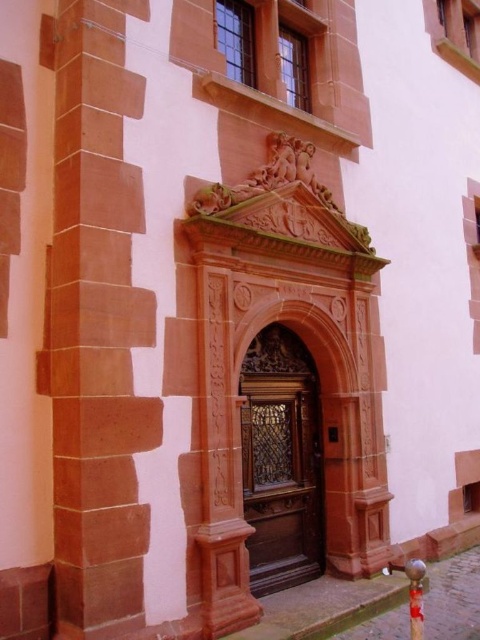
Question: Does brown carved wood door at center appear on the right side of shiny metallic pole at center?

Choices:
 (A) no
 (B) yes

Answer: (A)

Question: Which point is closer to the camera?

Choices:
 (A) (97, 214)
 (B) (416, 637)

Answer: (B)

Question: Where is red stone pillar at left located in relation to shiny metallic pole at center in the image?

Choices:
 (A) above
 (B) below

Answer: (A)

Question: Is brown carved wood door at center wider than shiny metallic pole at center?

Choices:
 (A) yes
 (B) no

Answer: (A)

Question: Estimate the real-world distances between objects in this image. Which object is closer to the red stone pillar at left?

Choices:
 (A) brown carved wood door at center
 (B) shiny metallic pole at center

Answer: (A)

Question: Which object is the closest to the brown carved wood door at center?

Choices:
 (A) red stone pillar at left
 (B) shiny metallic pole at center

Answer: (B)